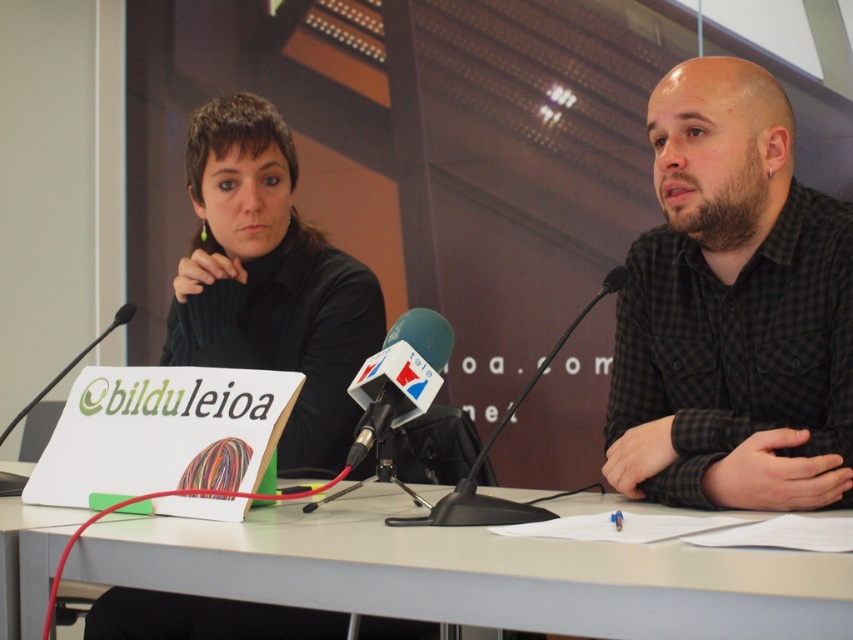
You are a photographer at the event and need to position your camera to capture both the white plastic table at center and the black plastic microphone at center clearly. Based on their positions, which object should you focus on first to ensure both are in frame?

The white plastic table at center is located below the black plastic microphone at center, so you should focus on the black plastic microphone at center first to ensure both are in frame.

Based on the photo, you are a photographer setting up for a press conference. You need to place a camera on the table so it can capture both the white plastic table at center and the black plastic microphone at center clearly. Considering their heights, which object should you position the camera closer to?

The white plastic table at center is not as tall as the black plastic microphone at center, so you should position the camera closer to the black plastic microphone at center to ensure both objects are in clear focus.